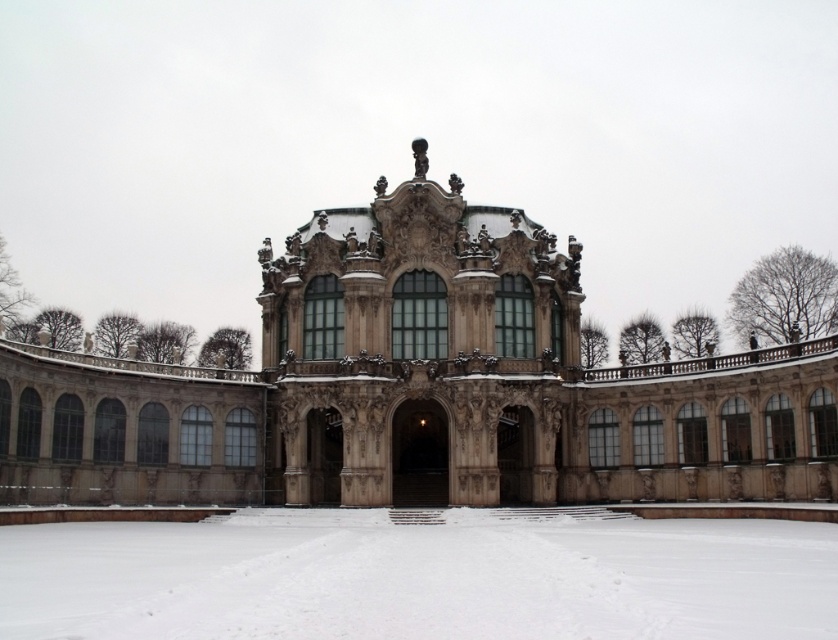
Question: Does brown stone palace at center come behind white powdery snow at center?

Choices:
 (A) no
 (B) yes

Answer: (B)

Question: Is brown stone palace at center closer to the viewer compared to white powdery snow at center?

Choices:
 (A) yes
 (B) no

Answer: (B)

Question: Which object is farther from the camera taking this photo?

Choices:
 (A) white powdery snow at center
 (B) brown stone palace at center

Answer: (B)

Question: Is brown stone palace at center positioned before white powdery snow at center?

Choices:
 (A) no
 (B) yes

Answer: (A)

Question: Which point is farther from the camera taking this photo?

Choices:
 (A) (709, 598)
 (B) (299, 241)

Answer: (B)